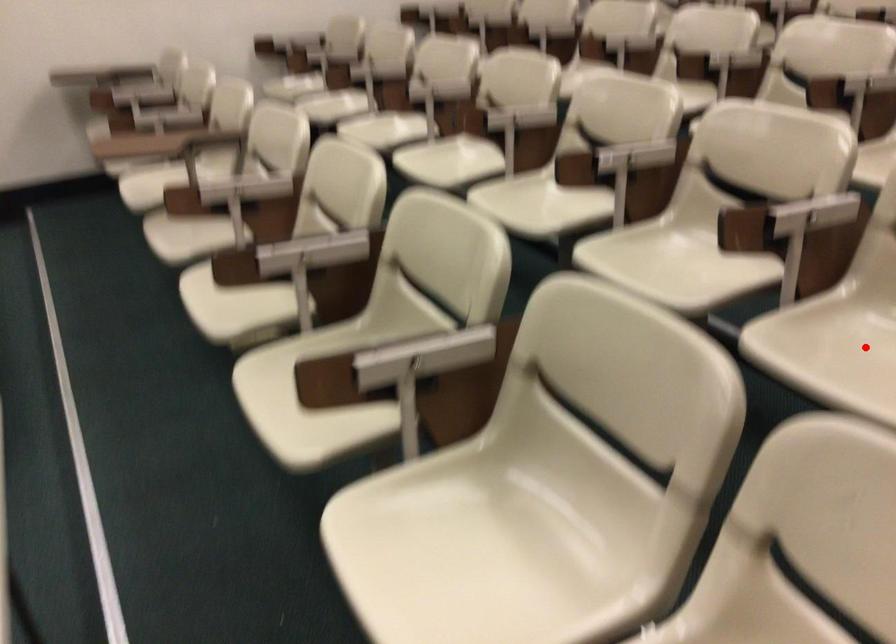
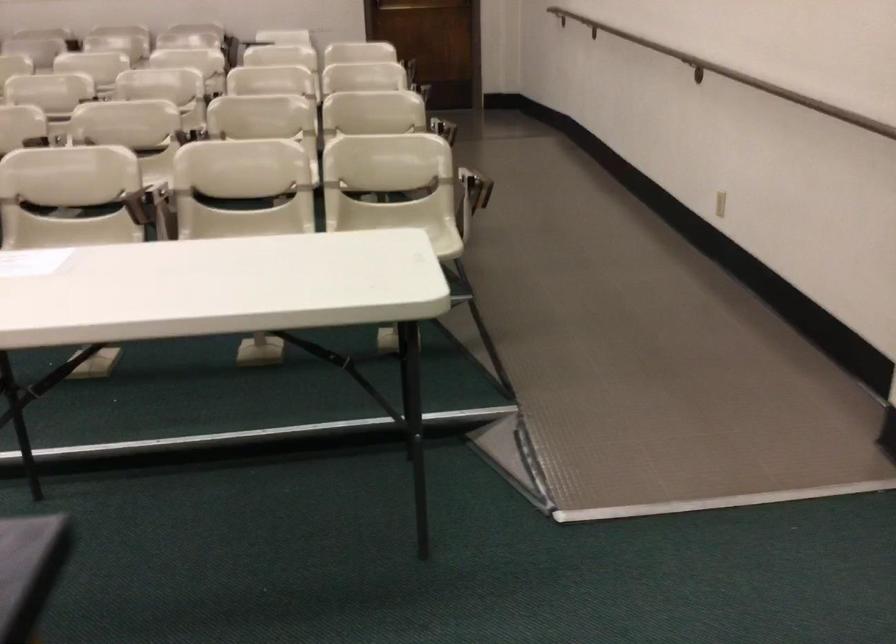
Question: I am providing you with two images of the same scene from different viewpoints. A red point is marked on the first image. At the location where the point appears in image 1, is it still visible in image 2?

Choices:
 (A) Yes
 (B) No

Answer: (B)